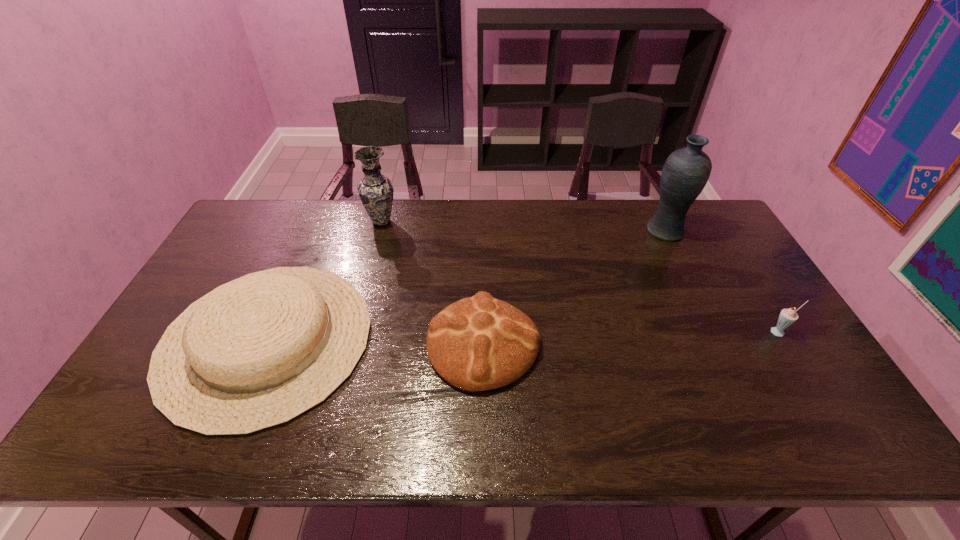
Find the location of `free spot at the right edge of the desktop`. free spot at the right edge of the desktop is located at coordinates (707, 265).

The image size is (960, 540). In the image, there is a desktop. Find the location of `free region at the far left corner`. free region at the far left corner is located at coordinates point(288,214).

Identify the location of free space at the near left corner. The height and width of the screenshot is (540, 960). (118, 427).

The height and width of the screenshot is (540, 960). In the image, there is a desktop. What are the coordinates of `vacant space at the far right corner` in the screenshot? It's located at (695, 232).

Where is `vacant area that lies between the third object from right to left and the rightmost object`? The height and width of the screenshot is (540, 960). vacant area that lies between the third object from right to left and the rightmost object is located at coordinates (632, 338).

The height and width of the screenshot is (540, 960). In order to click on vacant space that's between the third object from left to right and the taller vase in this screenshot , I will do `click(574, 288)`.

Locate an element on the screen. free space between the sunhat and the taller vase is located at coordinates (466, 286).

You are a GUI agent. You are given a task and a screenshot of the screen. Output one action in this format:
    pyautogui.click(x=<x>, y=<y>)
    Task: Click on the unoccupied area between the right vase and the sunhat
    
    Given the screenshot: What is the action you would take?
    pyautogui.click(x=466, y=286)

The width and height of the screenshot is (960, 540). Find the location of `free space that is in between the sunhat and the third object from right to left`. free space that is in between the sunhat and the third object from right to left is located at coordinates (375, 342).

Where is `free space between the shorter vase and the rightmost object`? free space between the shorter vase and the rightmost object is located at coordinates (581, 277).